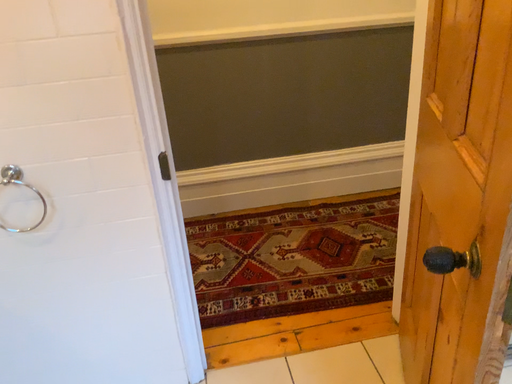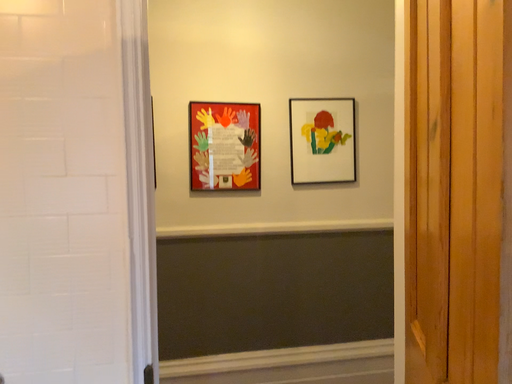
Question: How did the camera likely rotate when shooting the video?

Choices:
 (A) rotated downward
 (B) rotated upward

Answer: (B)